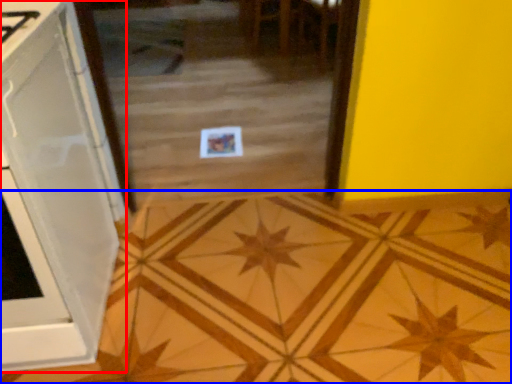
Question: Which point is further to the camera, cabinetry (highlighted by a red box) or ceramic tile (highlighted by a blue box)?

Choices:
 (A) cabinetry
 (B) ceramic tile

Answer: (B)